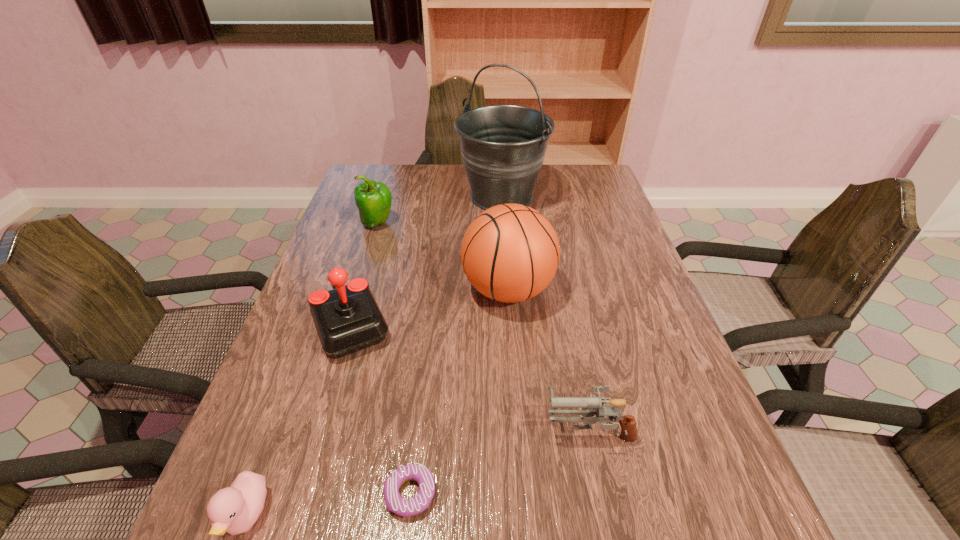
Locate an element on the screen. vacant area at the left edge is located at coordinates 354,232.

This screenshot has height=540, width=960. In the image, there is a desktop. What are the coordinates of `free space at the right edge` in the screenshot? It's located at (598, 322).

At what (x,y) coordinates should I click in order to perform the action: click on vacant region between the fifth tallest object and the joystick. Please return your answer as a coordinate pair (x, y). The image size is (960, 540). Looking at the image, I should click on (470, 377).

Locate an element on the screen. The height and width of the screenshot is (540, 960). free space between the doughnut and the second tallest object is located at coordinates (459, 392).

Image resolution: width=960 pixels, height=540 pixels. I want to click on unoccupied position between the third nearest object and the joystick, so click(x=470, y=377).

The width and height of the screenshot is (960, 540). Find the location of `empty space that is in between the bell pepper and the joystick`. empty space that is in between the bell pepper and the joystick is located at coordinates (365, 274).

The image size is (960, 540). In order to click on free space between the tallest object and the bell pepper in this screenshot , I will do `click(440, 210)`.

Identify the location of object that is the nearest to the duckling. This screenshot has width=960, height=540. (401, 506).

Where is `object that ranks as the third closest to the sixth tallest object`? The height and width of the screenshot is (540, 960). object that ranks as the third closest to the sixth tallest object is located at coordinates (591, 406).

What are the coordinates of `free space that satisfies the following two spatial constraints: 1. on the front side of the basketball; 2. on the left side of the bell pepper` in the screenshot? It's located at (357, 290).